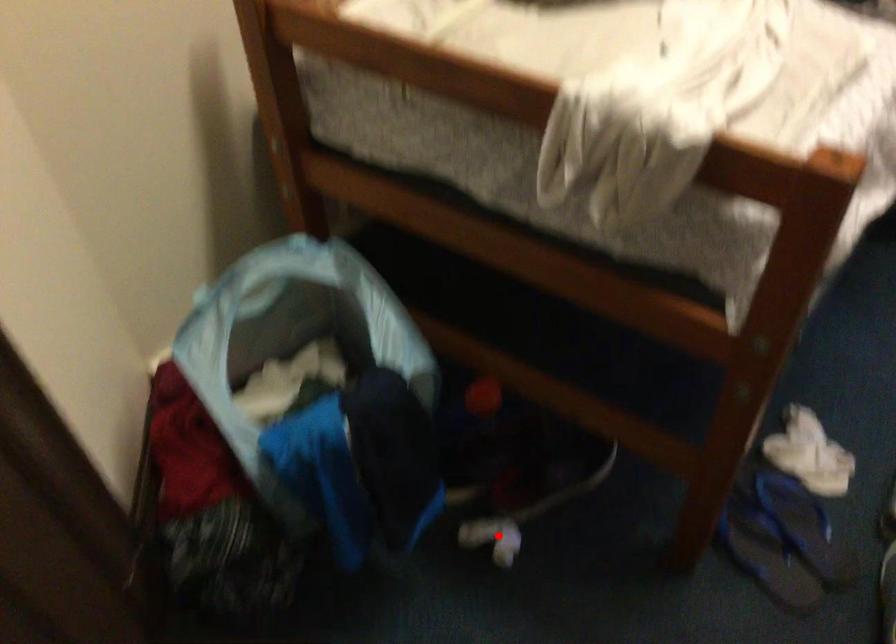
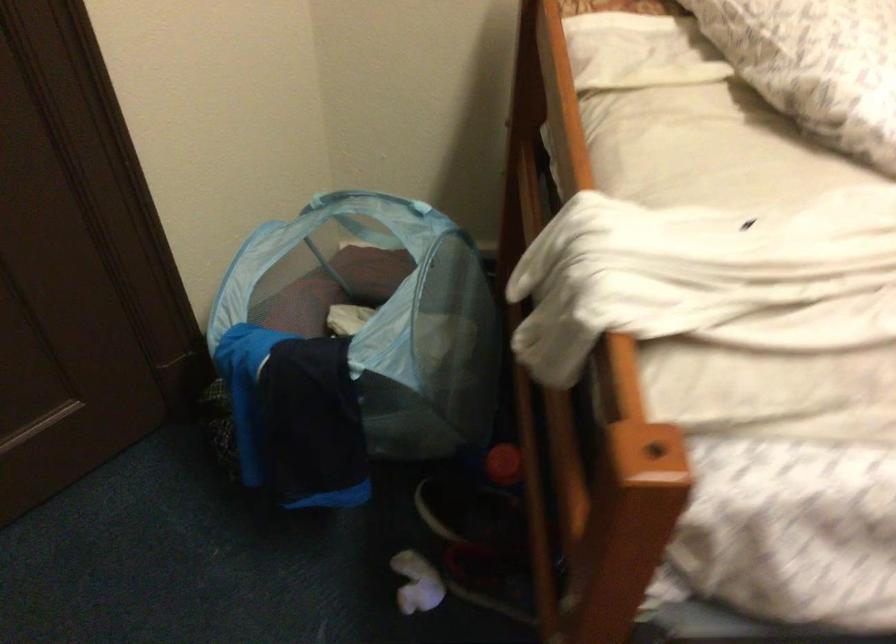
Find the pixel in the second image that matches the highlighted location in the first image.

(417, 583)